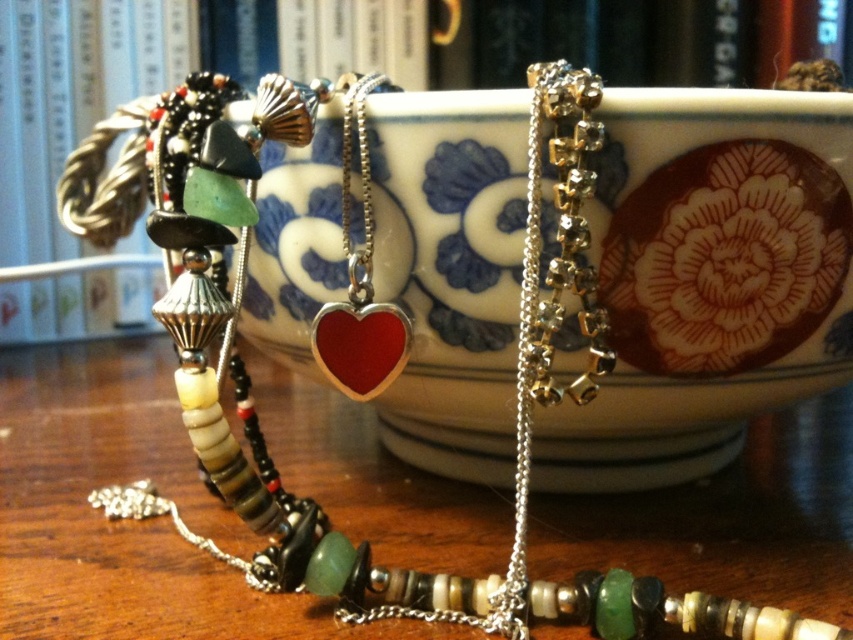
Does matte white bookshelf at upper center appear over shiny red heart at center?

Correct, matte white bookshelf at upper center is located above shiny red heart at center.

Does matte white bookshelf at upper center have a lesser width compared to shiny red heart at center?

Incorrect, matte white bookshelf at upper center's width is not less than shiny red heart at center's.

Identify the location of matte white bookshelf at upper center. The height and width of the screenshot is (640, 853). (99, 88).